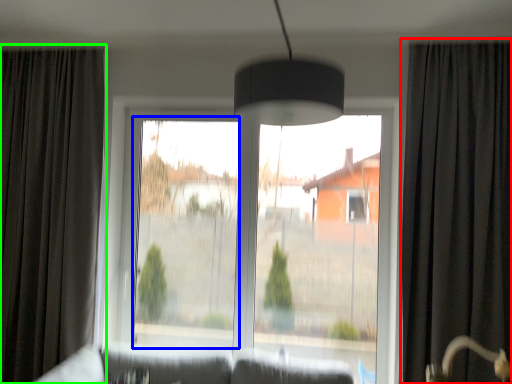
Question: Based on their relative distances, which object is nearer to curtain (highlighted by a red box)? Choose from window screen (highlighted by a blue box) and curtain (highlighted by a green box).

Choices:
 (A) window screen
 (B) curtain

Answer: (A)